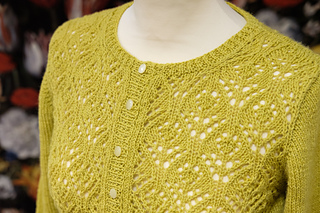
Identify the location of mannequin. (170, 36).